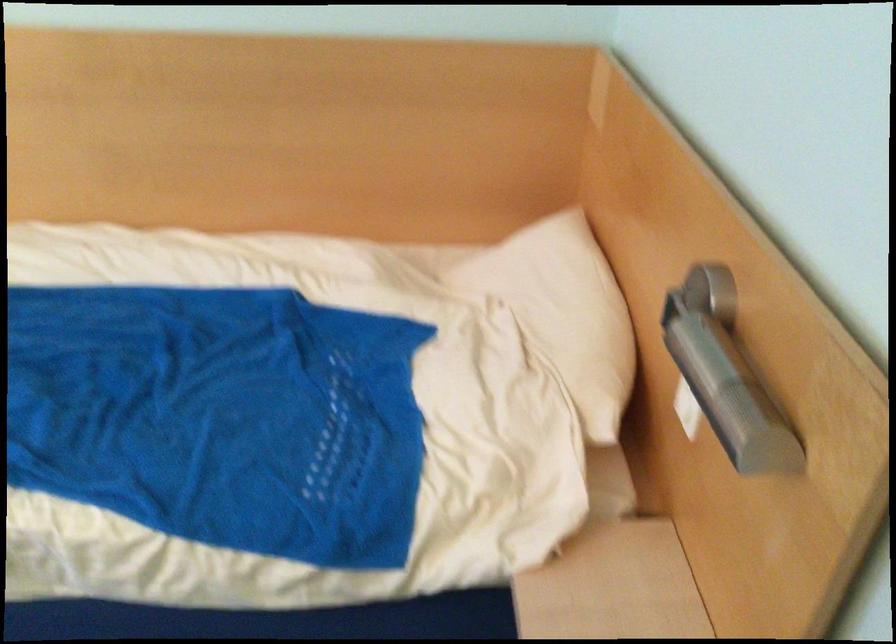
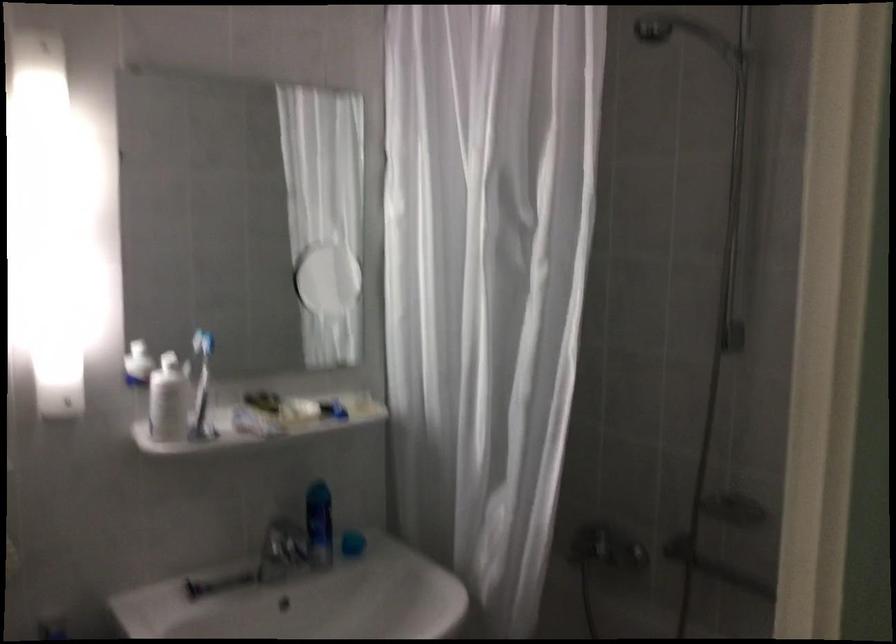
How did the camera likely rotate?

The rotation direction of the camera is right-up.